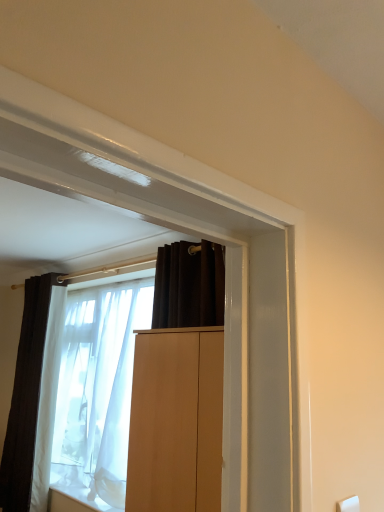
What do you see at coordinates (75, 500) in the screenshot?
I see `white matte window sill at lower left` at bounding box center [75, 500].

The image size is (384, 512). Describe the element at coordinates (98, 391) in the screenshot. I see `white sheer fabric at center` at that location.

You are a GUI agent. You are given a task and a screenshot of the screen. Output one action in this format:
    pyautogui.click(x=<x>, y=<y>)
    Task: Click on the translucent fabric window at center
    The height and width of the screenshot is (512, 384).
    Given the screenshot: What is the action you would take?
    pyautogui.click(x=172, y=422)

This screenshot has height=512, width=384. What are the coordinates of `dark matte curtain at left` in the screenshot? It's located at (27, 394).

From a real-world perspective, which object rests below the other?

dark matte curtain at left, from a real-world perspective.

Considering the relative positions of translucent fabric window at center and dark matte curtain at left in the image provided, is translucent fabric window at center to the right of dark matte curtain at left from the viewer's perspective?

Correct, you'll find translucent fabric window at center to the right of dark matte curtain at left.

Is translucent fabric window at center further to camera compared to dark matte curtain at left?

No, it is in front of dark matte curtain at left.

Based on the photo, from the image's perspective, which is below, translucent fabric window at center or dark matte curtain at left?

dark matte curtain at left, from the image's perspective.

Choose the correct answer: Is white matte window sill at lower left inside light brown wood cabinet at center or outside it?

white matte window sill at lower left is located beyond the bounds of light brown wood cabinet at center.

Which object is positioned more to the left, white matte window sill at lower left or light brown wood cabinet at center?

Positioned to the left is white matte window sill at lower left.

From the picture: From a real-world perspective, is white matte window sill at lower left positioned over light brown wood cabinet at center based on gravity?

Actually, white matte window sill at lower left is physically below light brown wood cabinet at center in the real world.

Is the depth of white matte window sill at lower left greater than that of light brown wood cabinet at center?

Yes.

How far apart are light brown wood cabinet at center and dark matte curtain at left?

light brown wood cabinet at center is 6.29 feet away from dark matte curtain at left.

In the scene shown: From a real-world perspective, relative to dark matte curtain at left, is light brown wood cabinet at center vertically above or below?

In terms of real-world spatial position, light brown wood cabinet at center is above dark matte curtain at left.

Is light brown wood cabinet at center next to dark matte curtain at left?

light brown wood cabinet at center and dark matte curtain at left are not in contact.

Considering the sizes of objects light brown wood cabinet at center and dark matte curtain at left in the image provided, who is taller, light brown wood cabinet at center or dark matte curtain at left?

dark matte curtain at left is taller.

Is white matte window sill at lower left to the left of white sheer fabric at center from the viewer's perspective?

Correct, you'll find white matte window sill at lower left to the left of white sheer fabric at center.

In the scene shown: Which object is closer to the camera, white matte window sill at lower left or white sheer fabric at center?

Positioned in front is white sheer fabric at center.

From the image's perspective, between white matte window sill at lower left and white sheer fabric at center, which one is located above?

white sheer fabric at center is shown above in the image.

Measure the distance from white matte window sill at lower left to white sheer fabric at center.

white matte window sill at lower left and white sheer fabric at center are 22.02 inches apart from each other.

From the image's perspective, relative to white sheer fabric at center, is translucent fabric window at center above or below?

translucent fabric window at center is above white sheer fabric at center.

Is point (197, 379) less distant than point (73, 457)?

Yes, it is.

Which is correct: translucent fabric window at center is inside white sheer fabric at center, or outside of it?

translucent fabric window at center exists entirely within white sheer fabric at center.

Would you say dark matte curtain at left is outside light brown wood cabinet at center?

Yes.

Can you tell me how much dark matte curtain at left and light brown wood cabinet at center differ in facing direction?

The angular difference between dark matte curtain at left and light brown wood cabinet at center is 0.366 degrees.

Which is behind, dark matte curtain at left or light brown wood cabinet at center?

Positioned behind is dark matte curtain at left.

Considering the sizes of dark matte curtain at left and light brown wood cabinet at center in the image, is dark matte curtain at left taller or shorter than light brown wood cabinet at center?

dark matte curtain at left is taller than light brown wood cabinet at center.

Is point (132, 325) more distant than point (28, 507)?

Yes.

Can you confirm if white sheer fabric at center is wider than translucent fabric window at center?

In fact, white sheer fabric at center might be narrower than translucent fabric window at center.

Could you tell me if white sheer fabric at center is turned towards translucent fabric window at center?

Yes, white sheer fabric at center is aimed at translucent fabric window at center.

In the scene shown: From the image's perspective, is white sheer fabric at center positioned above or below translucent fabric window at center?

From the image's perspective, white sheer fabric at center appears below translucent fabric window at center.

You are a GUI agent. You are given a task and a screenshot of the screen. Output one action in this format:
    pyautogui.click(x=<x>, y=<y>)
    Task: Click on the window on the right of dark matte curtain at left
    Image resolution: width=384 pixels, height=512 pixels.
    Given the screenshot: What is the action you would take?
    pyautogui.click(x=172, y=422)

What are the coordinates of `window sill below the light brown wood cabinet at center (from the image's perspective)` in the screenshot? It's located at (75, 500).

Which object lies further to the anchor point dark matte curtain at left, light brown wood cabinet at center or white sheer fabric at center?

light brown wood cabinet at center.

Estimate the real-world distances between objects in this image. Which object is further from translucent fabric window at center, white sheer fabric at center or white matte window sill at lower left?

white matte window sill at lower left.

Considering their positions, is white sheer fabric at center positioned further to light brown wood cabinet at center than dark matte curtain at left?

Based on the image, dark matte curtain at left appears to be further to light brown wood cabinet at center.

Which object lies further to the anchor point white sheer fabric at center, white matte window sill at lower left or dark matte curtain at left?

white matte window sill at lower left is further to white sheer fabric at center.

Considering their positions, is white matte window sill at lower left positioned further to white sheer fabric at center than light brown wood cabinet at center?

Based on the image, light brown wood cabinet at center appears to be further to white sheer fabric at center.

Consider the image. Which object lies nearer to the anchor point translucent fabric window at center, dark matte curtain at left or light brown wood cabinet at center?

Based on the image, dark matte curtain at left appears to be nearer to translucent fabric window at center.

From the image, which object appears to be nearer to white sheer fabric at center, light brown wood cabinet at center or translucent fabric window at center?

translucent fabric window at center.

Estimate the real-world distances between objects in this image. Which object is closer to translucent fabric window at center, white matte window sill at lower left or white sheer fabric at center?

Based on the image, white sheer fabric at center appears to be nearer to translucent fabric window at center.

Identify the location of shower curtain that lies between translucent fabric window at center and white matte window sill at lower left from top to bottom. Image resolution: width=384 pixels, height=512 pixels. (98, 391).

Locate an element on the screen. This screenshot has height=512, width=384. shower curtain between translucent fabric window at center and dark matte curtain at left from front to back is located at coordinates (98, 391).

Identify the location of shower curtain between dark matte curtain at left and light brown wood cabinet at center. (98, 391).

Identify the location of window between light brown wood cabinet at center and dark matte curtain at left from front to back. The width and height of the screenshot is (384, 512). (172, 422).